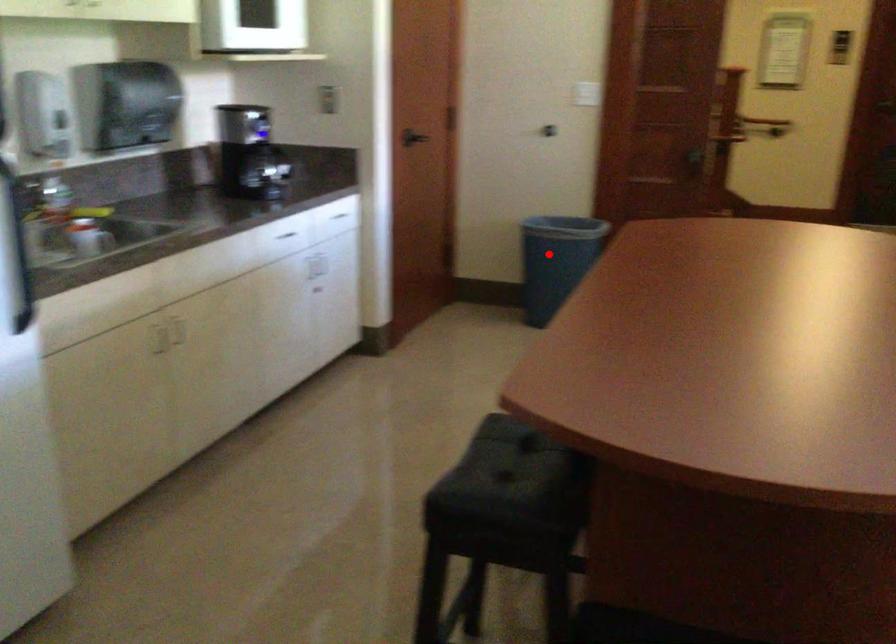
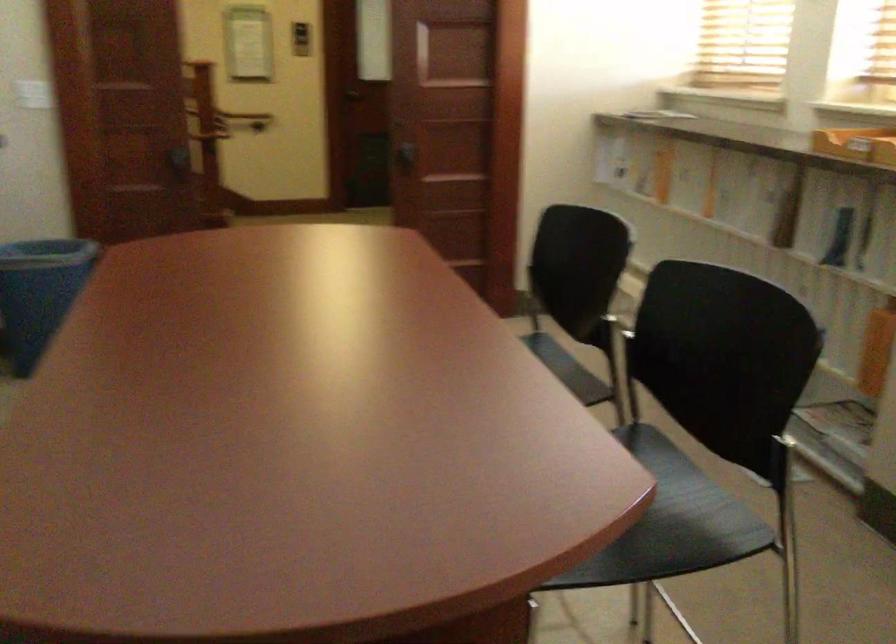
Find the pixel in the second image that matches the highlighted location in the first image.

(39, 294)